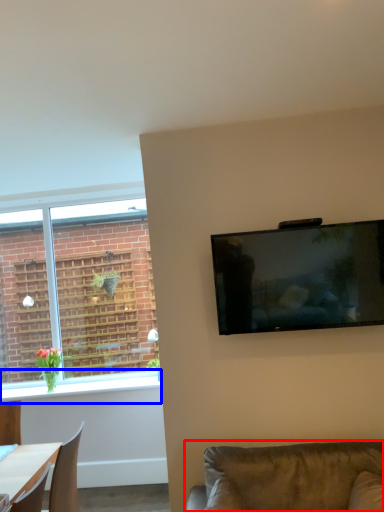
Question: Among these objects, which one is farthest to the camera, studio couch (highlighted by a red box) or window sill (highlighted by a blue box)?

Choices:
 (A) studio couch
 (B) window sill

Answer: (B)